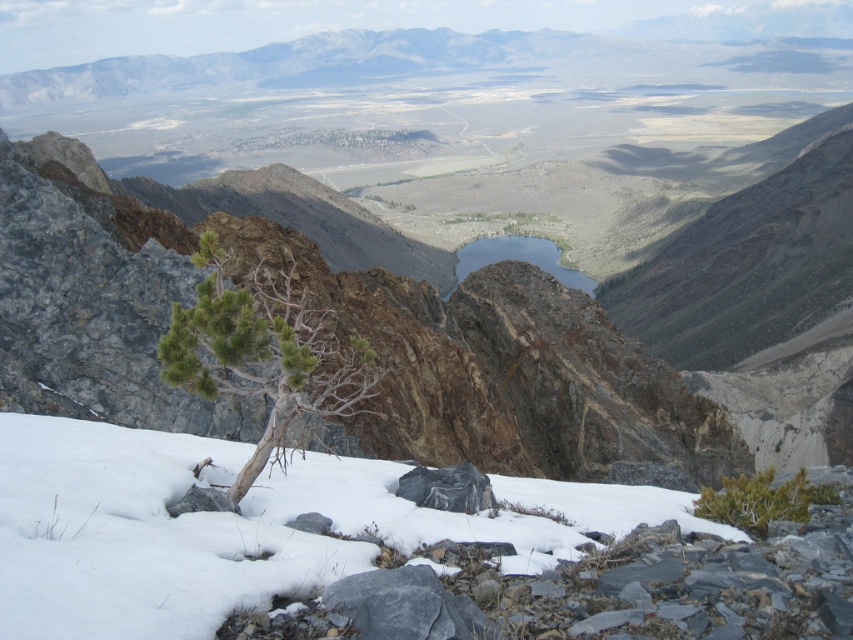
You are standing at the viewpoint overlooking the valley and see two points marked on the landscape. The first point is at coordinates point (424, 490) and the second is at point (202, 490). Which point is closer to your current position?

Point (202, 490) is closer to your current position because it is closer to the camera than point (424, 490).